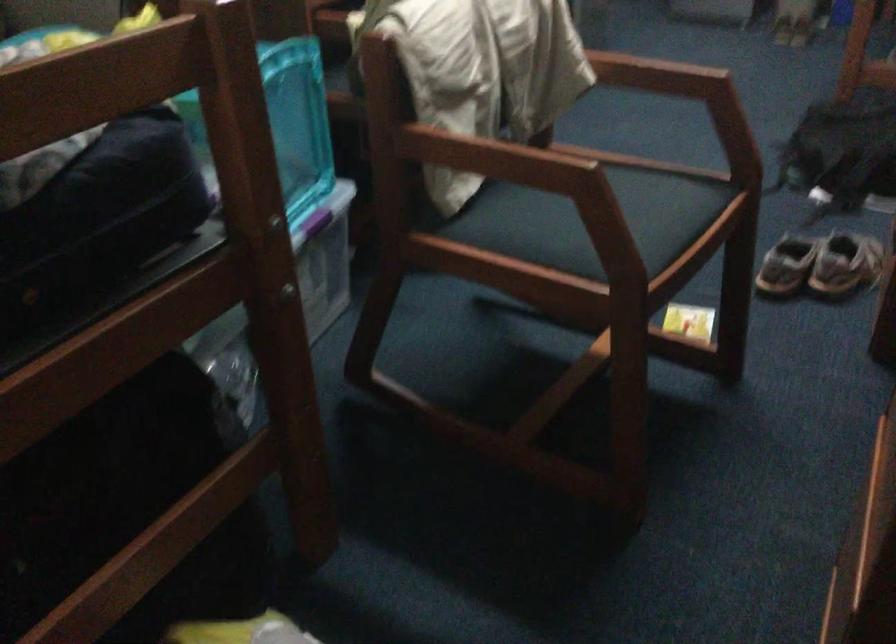
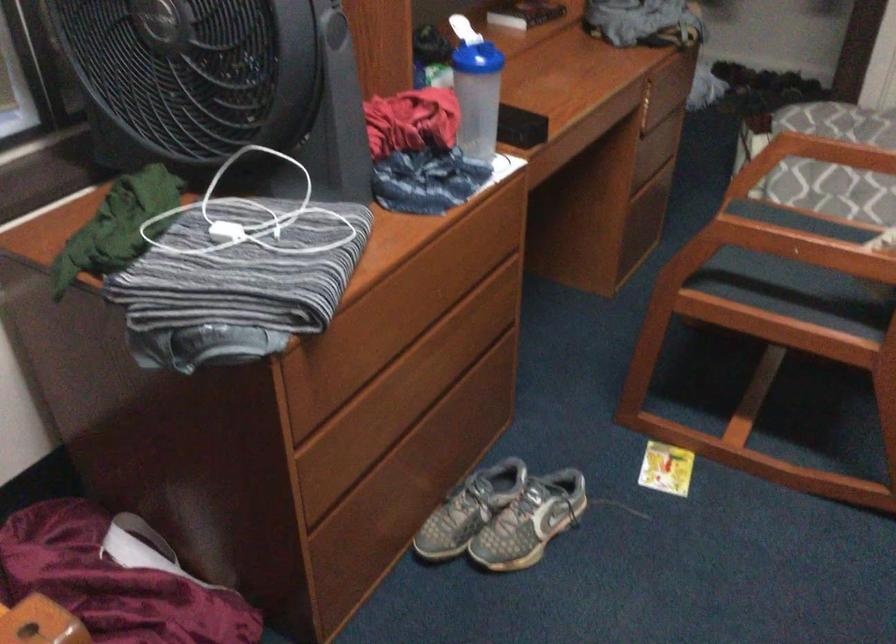
Locate, in the second image, the point that corresponds to point 693,324 in the first image.

(666, 468)